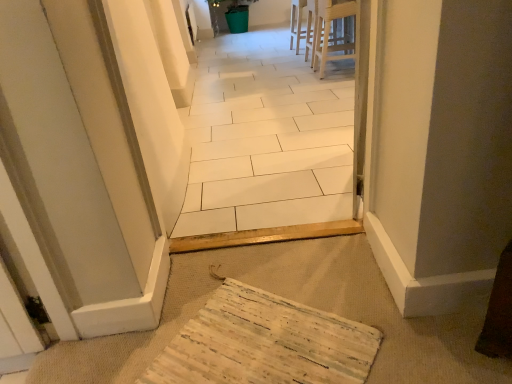
Question: From the image's perspective, is white wood chair at upper center on light wood stool at upper center?

Choices:
 (A) yes
 (B) no

Answer: (A)

Question: From a real-world perspective, is white wood chair at upper center physically above light wood stool at upper center?

Choices:
 (A) yes
 (B) no

Answer: (B)

Question: Can you confirm if white wood chair at upper center is thinner than light wood stool at upper center?

Choices:
 (A) yes
 (B) no

Answer: (A)

Question: Does white wood chair at upper center have a greater width compared to light wood stool at upper center?

Choices:
 (A) yes
 (B) no

Answer: (B)

Question: Is there a large distance between white wood chair at upper center and light wood stool at upper center?

Choices:
 (A) no
 (B) yes

Answer: (A)

Question: From the image's perspective, is wooden textured mat at lower center positioned above or below white wood chair at upper center?

Choices:
 (A) above
 (B) below

Answer: (B)

Question: From their relative heights in the image, would you say wooden textured mat at lower center is taller or shorter than white wood chair at upper center?

Choices:
 (A) tall
 (B) short

Answer: (B)

Question: In terms of width, does wooden textured mat at lower center look wider or thinner when compared to white wood chair at upper center?

Choices:
 (A) wide
 (B) thin

Answer: (A)

Question: In the image, is wooden textured mat at lower center on the left side or the right side of white wood chair at upper center?

Choices:
 (A) right
 (B) left

Answer: (B)

Question: From a real-world perspective, relative to light wood stool at upper center, is wooden textured mat at lower center vertically above or below?

Choices:
 (A) below
 (B) above

Answer: (A)

Question: Do you think wooden textured mat at lower center is within light wood stool at upper center, or outside of it?

Choices:
 (A) outside
 (B) inside

Answer: (A)

Question: In terms of size, does wooden textured mat at lower center appear bigger or smaller than light wood stool at upper center?

Choices:
 (A) big
 (B) small

Answer: (B)

Question: In the image, is wooden textured mat at lower center on the left side or the right side of light wood stool at upper center?

Choices:
 (A) left
 (B) right

Answer: (A)

Question: Based on their sizes in the image, would you say light wood stool at upper center is bigger or smaller than white wood chair at upper center?

Choices:
 (A) big
 (B) small

Answer: (A)

Question: In the image, is light wood stool at upper center positioned in front of or behind white wood chair at upper center?

Choices:
 (A) front
 (B) behind

Answer: (A)